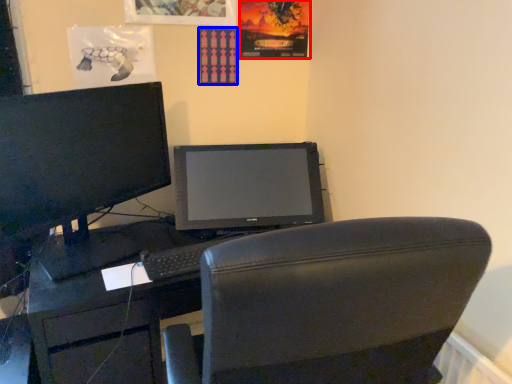
Question: Which point is closer to the camera, poster page (highlighted by a red box) or poster page (highlighted by a blue box)?

Choices:
 (A) poster page
 (B) poster page

Answer: (A)